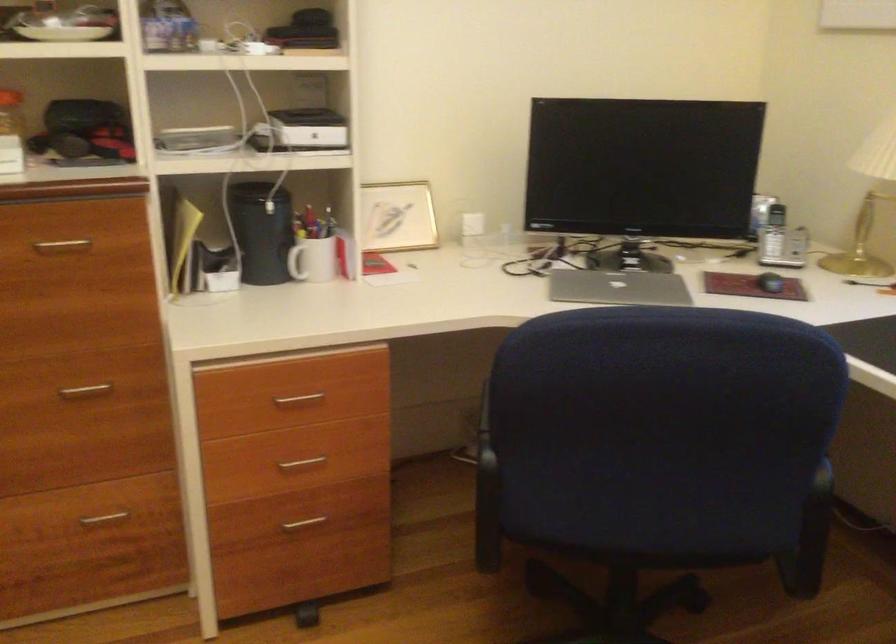
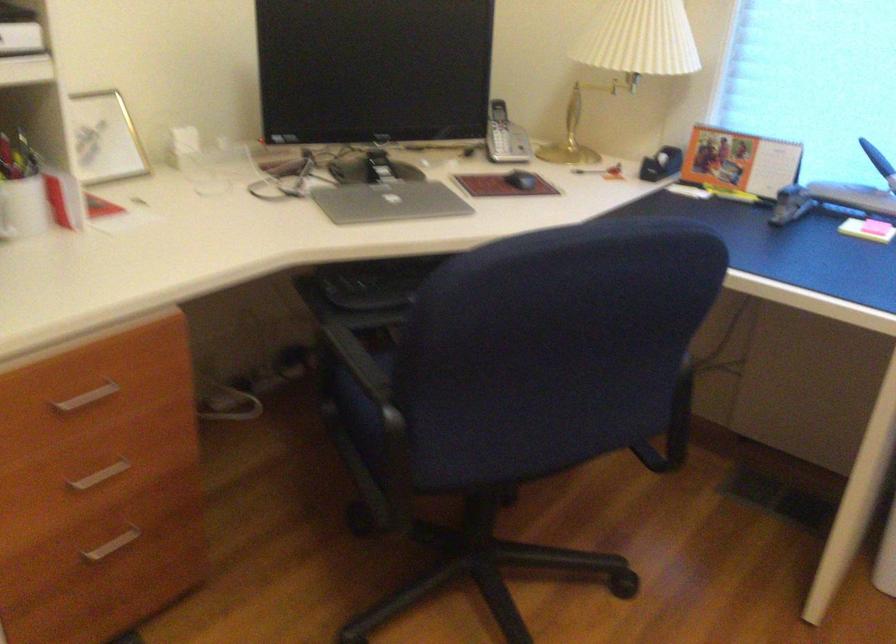
The point at (305,402) is marked in the first image. Where is the corresponding point in the second image?

(87, 397)